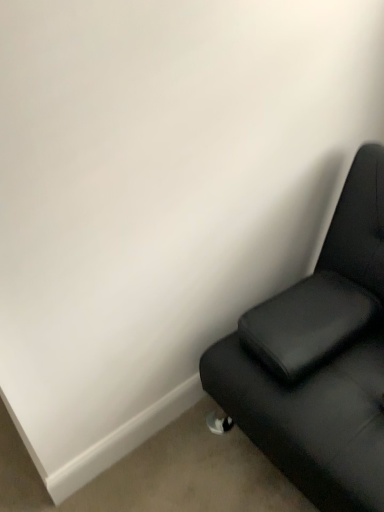
Where is `black leather couch at lower right`? Image resolution: width=384 pixels, height=512 pixels. black leather couch at lower right is located at coordinates (319, 359).

What do you see at coordinates (319, 359) in the screenshot? I see `black leather couch at lower right` at bounding box center [319, 359].

Identify the location of black leather couch at lower right. Image resolution: width=384 pixels, height=512 pixels. (319, 359).